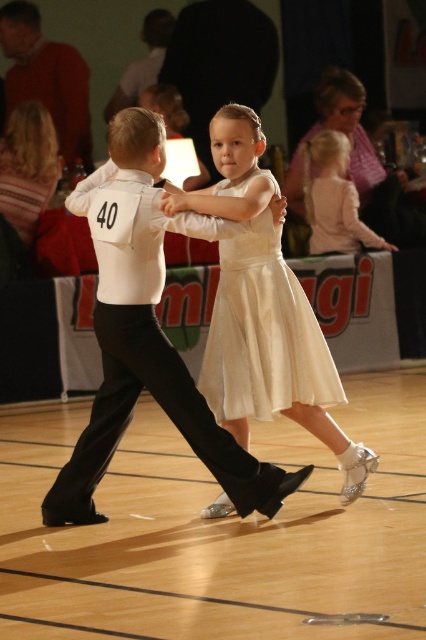
You are a photographer setting up for a dance performance. You need to position your camera so that both the matte white shirt at center and the white satin suit at center are fully visible. Given their sizes, which object should you ensure has more space allocated in the camera frame?

The matte white shirt at center has a lesser width compared to the white satin suit at center, so you should allocate more space in the camera frame for the white satin suit at center to ensure it is fully captured.

You are a photographer at the dance performance. You need to capture a photo where both the matte white shirt at center and the white satin suit at center are clearly visible. Based on their positions, which one should you focus on first to ensure it is in sharp focus?

The matte white shirt at center is below the white satin suit at center, so you should focus on the white satin suit at center first to ensure it is in sharp focus since it is higher up and more likely to be in the focal plane.

You are a photographer standing at the back of the dance floor. You want to take a photo that includes both the white satin dress at center and the light pink fabric dress at upper right. Given that your camera has a maximum focus range of 8 meters, will you be able to capture both dresses in focus?

The distance between the white satin dress at center and the light pink fabric dress at upper right is 7.99 meters, which is within the camera maximum focus range of 8 meters. Therefore, you can capture both dresses in focus.